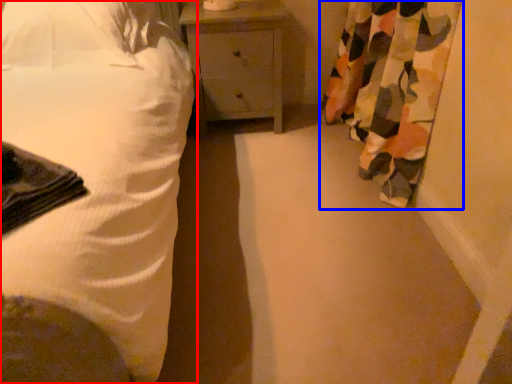
Question: Which point is closer to the camera, bed (highlighted by a red box) or curtain (highlighted by a blue box)?

Choices:
 (A) bed
 (B) curtain

Answer: (A)